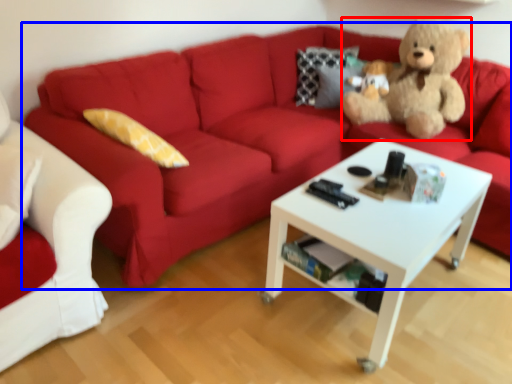
Question: Which object appears farthest to the camera in this image, teddy bear (highlighted by a red box) or studio couch (highlighted by a blue box)?

Choices:
 (A) teddy bear
 (B) studio couch

Answer: (A)